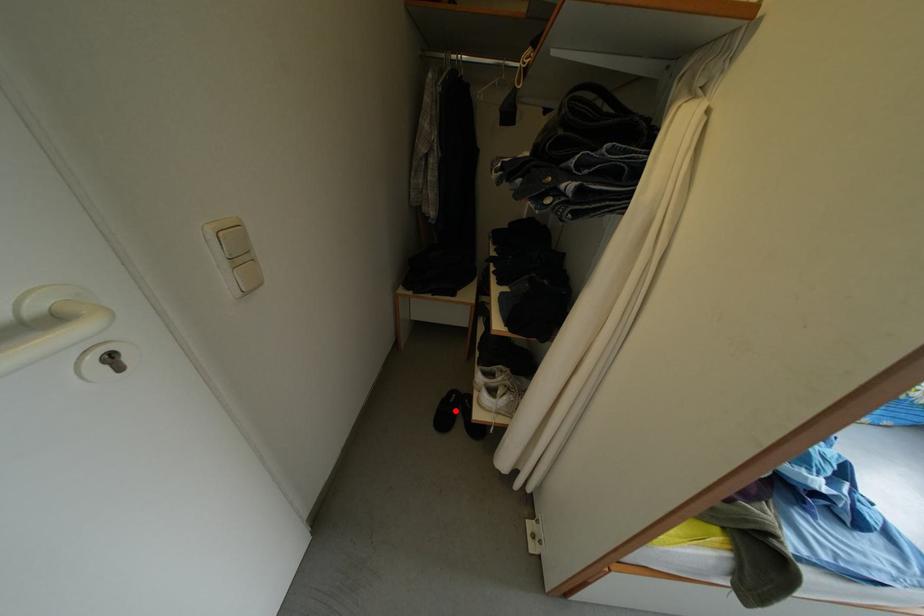
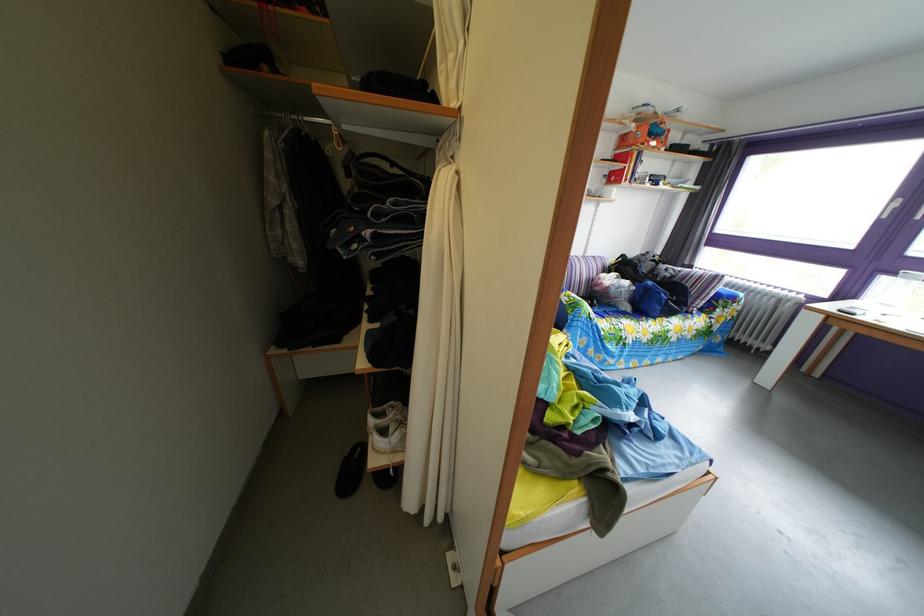
Where in the second image is the point corresponding to the highlighted location from the first image?

(359, 469)